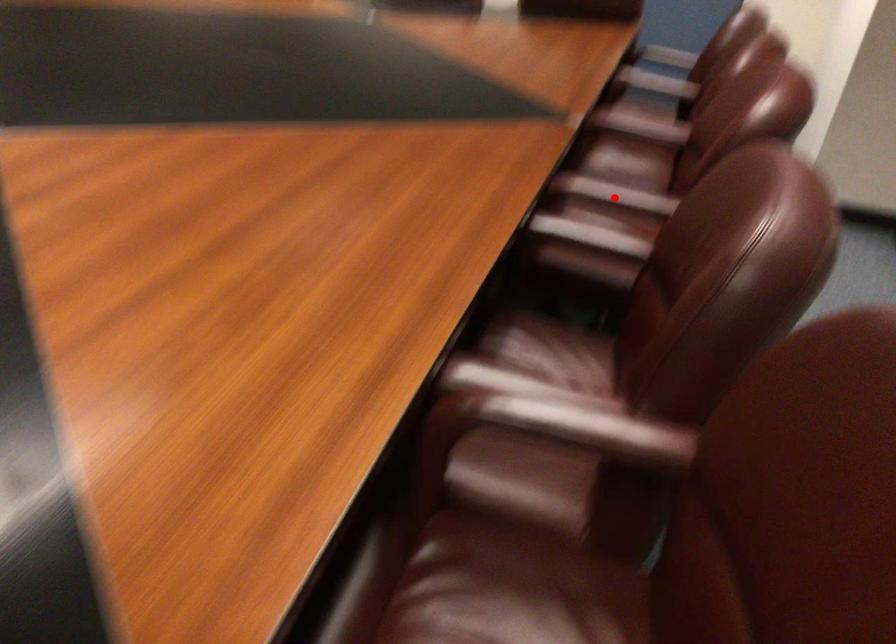
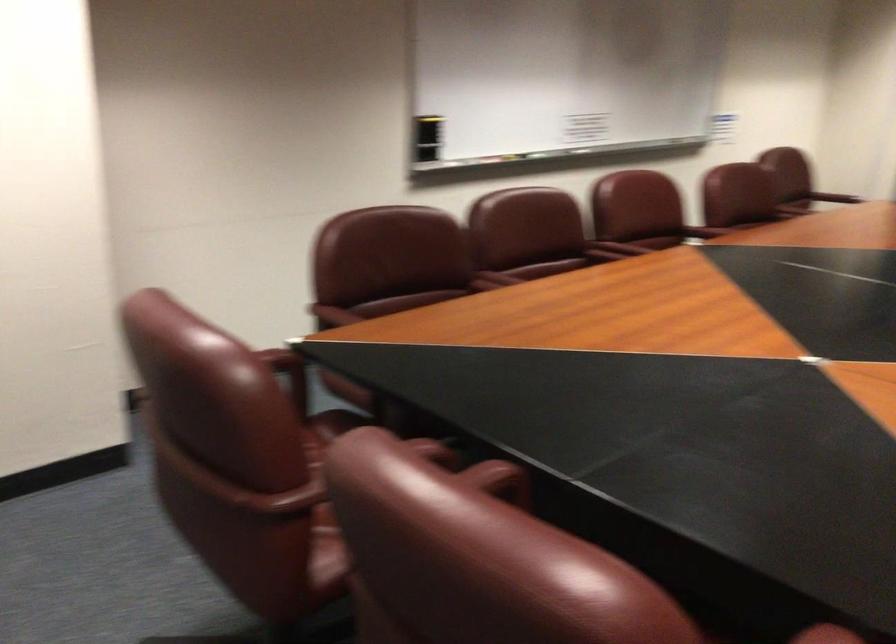
Find the pixel in the second image that matches the highlighted location in the first image.

(703, 232)